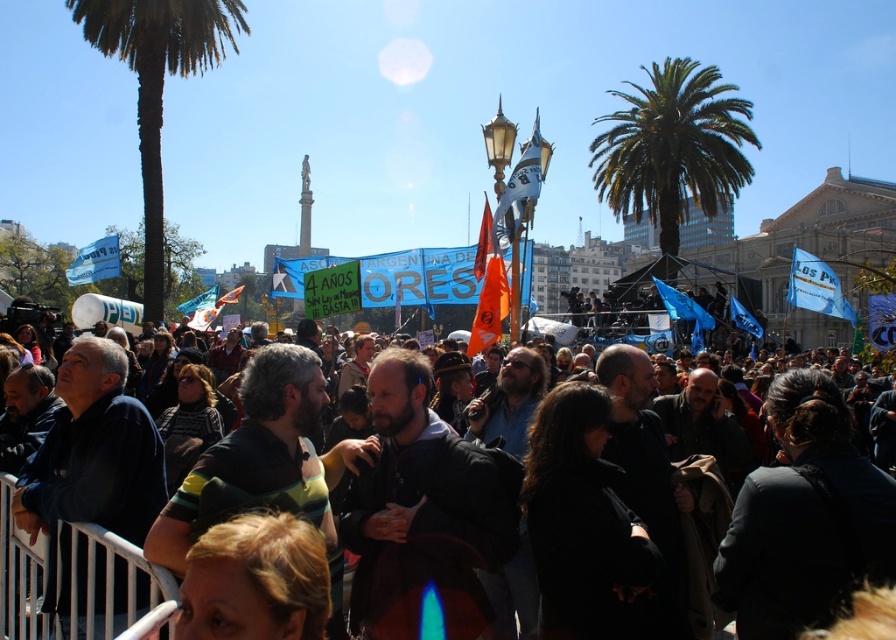
Question: Considering the real-world distances, which object is closest to the dark clothing crowd at center?

Choices:
 (A) green leafy palm tree at upper right
 (B) green leafy palm tree at left

Answer: (B)

Question: In this image, where is green leafy palm tree at upper right located relative to dark clothing crowd at center?

Choices:
 (A) below
 (B) above

Answer: (B)

Question: Which of the following is the closest to the observer?

Choices:
 (A) (96, 572)
 (B) (734, 148)

Answer: (A)

Question: Which object is the farthest from the green leafy palm tree at upper right?

Choices:
 (A) dark clothing crowd at center
 (B) green leafy palm tree at left

Answer: (A)

Question: Does green leafy palm tree at upper right come in front of dark clothing crowd at center?

Choices:
 (A) yes
 (B) no

Answer: (B)

Question: Can you confirm if green leafy palm tree at upper right is positioned to the right of green leafy palm tree at left?

Choices:
 (A) yes
 (B) no

Answer: (A)